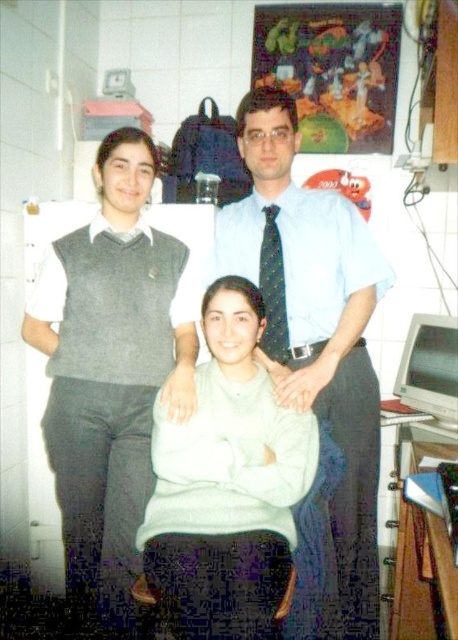
Question: Can you confirm if light blue shirt at center is positioned above light gray sweater at center?

Choices:
 (A) yes
 (B) no

Answer: (A)

Question: Which is farther from the gray wool sweater vest at left?

Choices:
 (A) light gray sweater at center
 (B) light blue shirt at center
 (C) black dotted tie at center

Answer: (B)

Question: Does gray wool sweater vest at left appear under black dotted tie at center?

Choices:
 (A) yes
 (B) no

Answer: (A)

Question: Estimate the real-world distances between objects in this image. Which object is closer to the black dotted tie at center?

Choices:
 (A) gray wool sweater vest at left
 (B) light gray sweater at center
 (C) light blue shirt at center

Answer: (C)

Question: Among these objects, which one is nearest to the camera?

Choices:
 (A) light blue shirt at center
 (B) gray wool sweater vest at left

Answer: (A)

Question: Is gray wool sweater vest at left to the left of black dotted tie at center from the viewer's perspective?

Choices:
 (A) no
 (B) yes

Answer: (B)